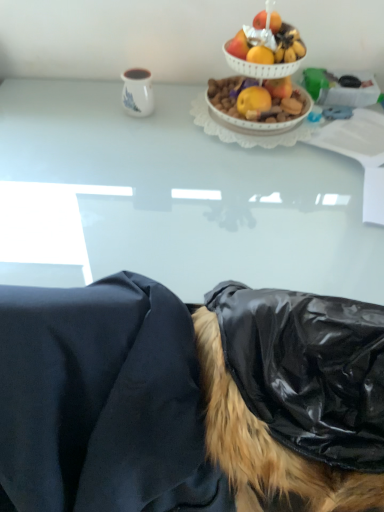
Question: From a real-world perspective, is shiny white bowl at upper center over black fabric at lower center?

Choices:
 (A) yes
 (B) no

Answer: (A)

Question: Is shiny white bowl at upper center further to camera compared to black fabric at lower center?

Choices:
 (A) no
 (B) yes

Answer: (B)

Question: From a real-world perspective, is shiny white bowl at upper center below black fabric at lower center?

Choices:
 (A) no
 (B) yes

Answer: (A)

Question: Is black fabric at lower center surrounded by shiny white bowl at upper center?

Choices:
 (A) no
 (B) yes

Answer: (A)

Question: From the image's perspective, would you say shiny white bowl at upper center is shown under black fabric at lower center?

Choices:
 (A) yes
 (B) no

Answer: (B)

Question: Is white ceramic mug at upper center inside or outside of black glossy wig at lower right?

Choices:
 (A) inside
 (B) outside

Answer: (B)

Question: Is white ceramic mug at upper center taller or shorter than black glossy wig at lower right?

Choices:
 (A) tall
 (B) short

Answer: (B)

Question: From the image's perspective, is white ceramic mug at upper center located above or below black glossy wig at lower right?

Choices:
 (A) below
 (B) above

Answer: (B)

Question: Looking at the image, does white ceramic mug at upper center seem bigger or smaller compared to black glossy wig at lower right?

Choices:
 (A) big
 (B) small

Answer: (B)

Question: From a real-world perspective, relative to white ceramic mug at upper center, is black glossy wig at lower right vertically above or below?

Choices:
 (A) above
 (B) below

Answer: (B)

Question: Based on their sizes in the image, would you say black glossy wig at lower right is bigger or smaller than white ceramic mug at upper center?

Choices:
 (A) big
 (B) small

Answer: (A)

Question: Considering their positions, is black glossy wig at lower right located in front of or behind white ceramic mug at upper center?

Choices:
 (A) behind
 (B) front

Answer: (B)

Question: Is black glossy wig at lower right spatially inside white ceramic mug at upper center, or outside of it?

Choices:
 (A) outside
 (B) inside

Answer: (A)

Question: Is shiny white bowl at upper center to the left or to the right of white glossy table at upper center in the image?

Choices:
 (A) right
 (B) left

Answer: (A)

Question: In terms of size, does shiny white bowl at upper center appear bigger or smaller than white glossy table at upper center?

Choices:
 (A) big
 (B) small

Answer: (B)